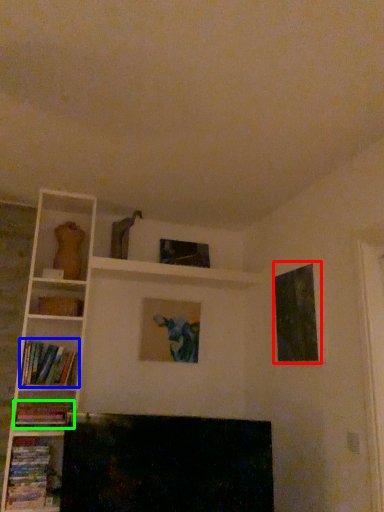
Question: Estimate the real-world distances between objects in this image. Which object is farther from picture frame (highlighted by a red box), book (highlighted by a blue box) or book (highlighted by a green box)?

Choices:
 (A) book
 (B) book

Answer: (B)